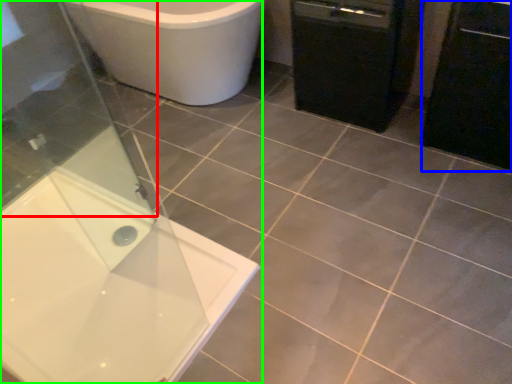
Question: Which is nearer to the screen door (highlighted by a red box)? cabinetry (highlighted by a blue box) or bathtub (highlighted by a green box).

Choices:
 (A) cabinetry
 (B) bathtub

Answer: (B)